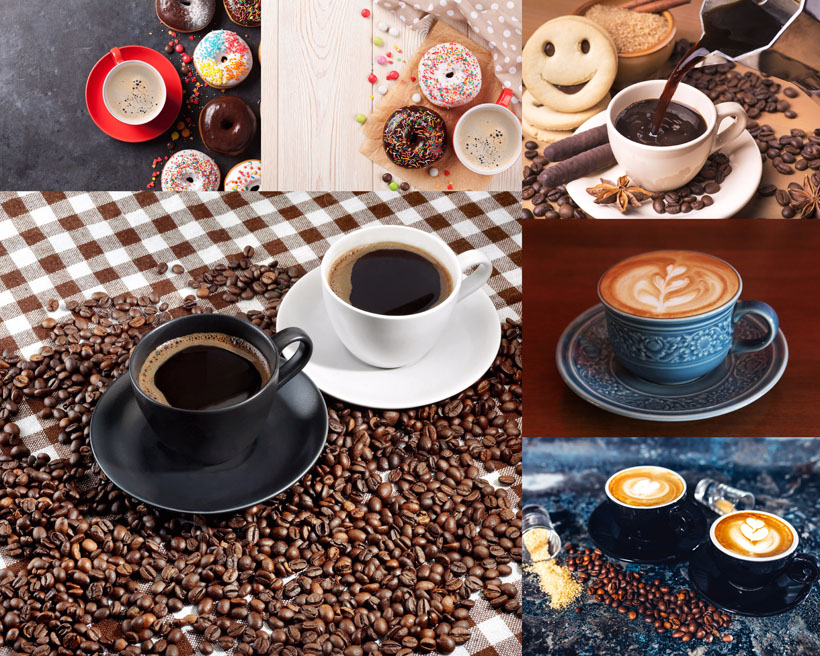
I want to click on saucers, so click(x=404, y=384), click(x=284, y=441), click(x=128, y=134), click(x=584, y=365), click(x=729, y=188), click(x=740, y=604), click(x=668, y=550).